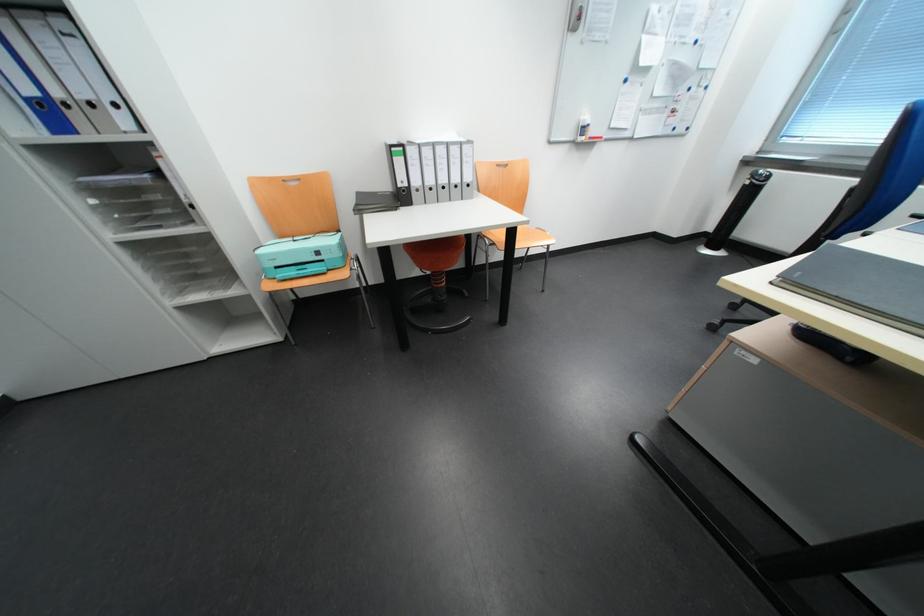
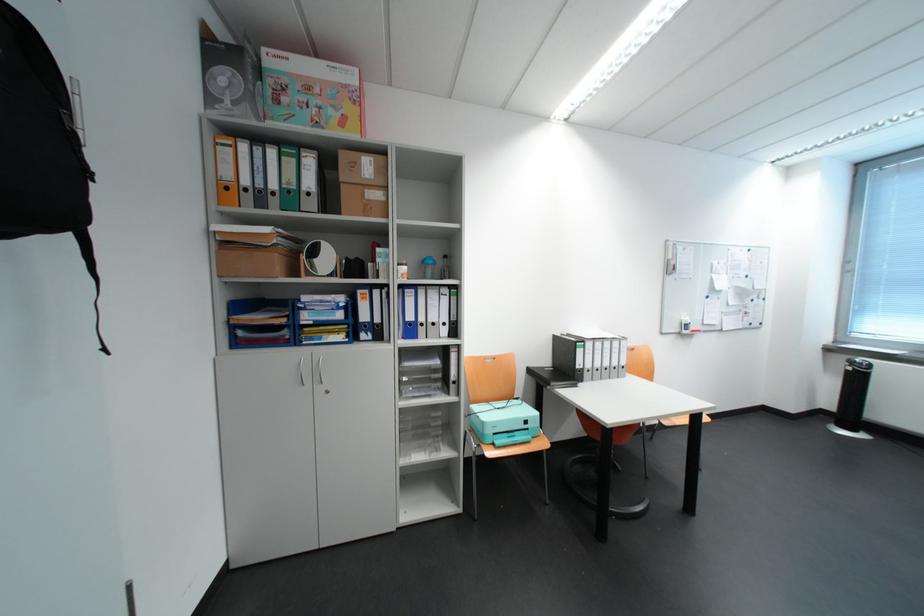
Find the pixel in the second image that matches point (453, 152) in the first image.

(618, 345)